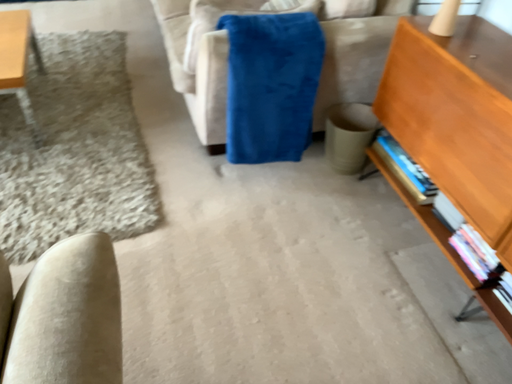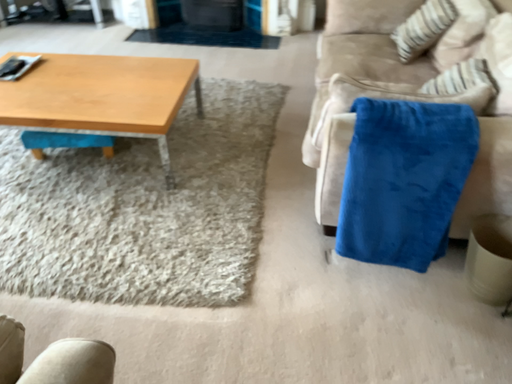
Question: How did the camera likely rotate when shooting the video?

Choices:
 (A) rotated downward
 (B) rotated upward

Answer: (B)